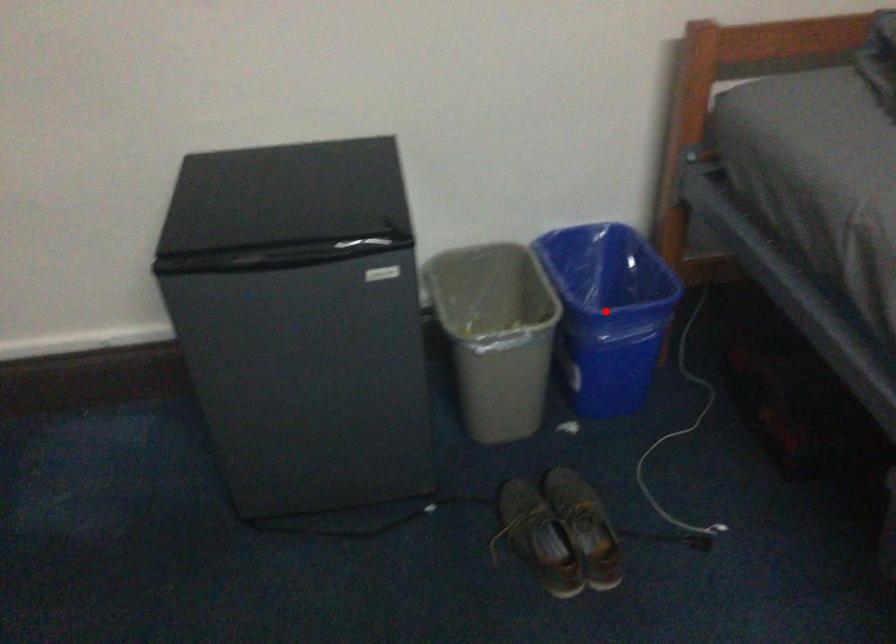
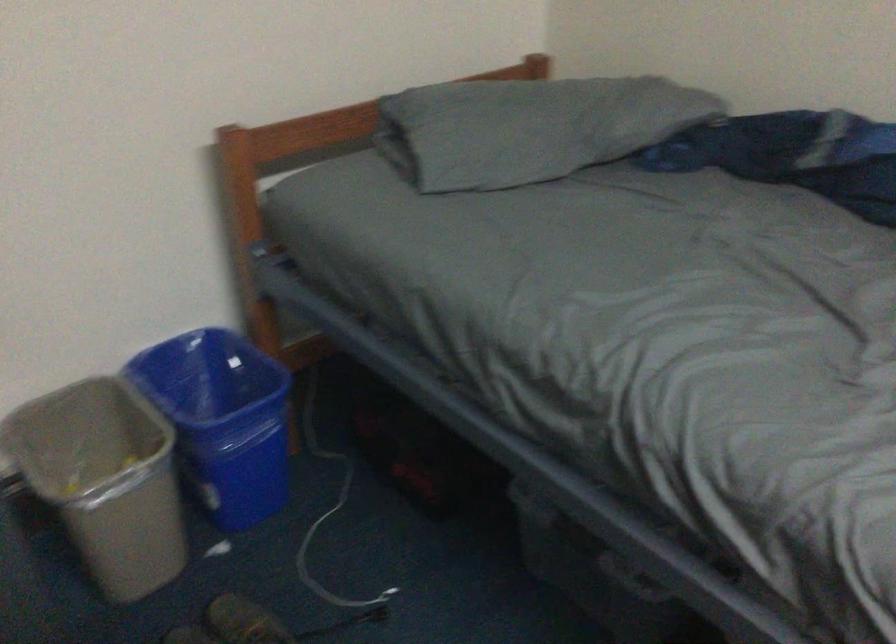
Question: I am providing you with two images of the same scene from different viewpoints. A red point is marked on the first image. Can you still see the location of the red point in image 2?

Choices:
 (A) Yes
 (B) No

Answer: (A)